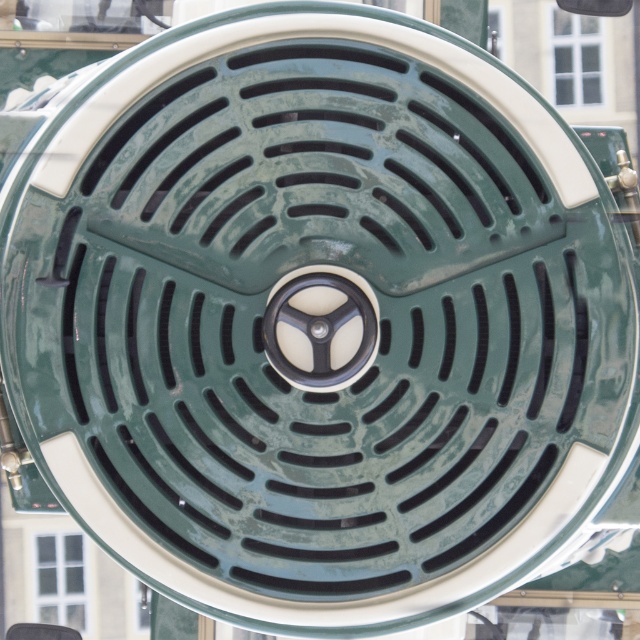
Question: Is transparent glass window at lower left wider than clear glass window at upper center?

Choices:
 (A) yes
 (B) no

Answer: (B)

Question: Does transparent glass window at lower left have a greater width compared to clear glass window at upper center?

Choices:
 (A) no
 (B) yes

Answer: (A)

Question: Is transparent glass window at lower left thinner than clear glass window at upper center?

Choices:
 (A) no
 (B) yes

Answer: (B)

Question: Among these points, which one is farthest from the camera?

Choices:
 (A) (563, 72)
 (B) (65, 618)

Answer: (A)

Question: Among these objects, which one is nearest to the camera?

Choices:
 (A) clear glass window at upper center
 (B) transparent glass window at lower left

Answer: (B)